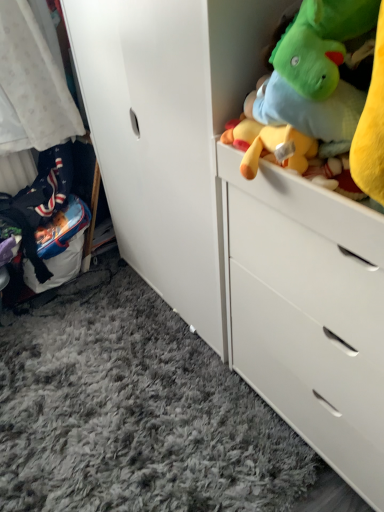
Question: From the image's perspective, relative to soft plush toys at upper right, is white matte chest of drawers at upper right above or below?

Choices:
 (A) above
 (B) below

Answer: (B)

Question: From a real-world perspective, is white matte chest of drawers at upper right positioned above or below soft plush toys at upper right?

Choices:
 (A) above
 (B) below

Answer: (B)

Question: Considering the real-world distances, which object is closest to the white soft fabric at left?

Choices:
 (A) soft plush toys at upper right
 (B) white matte chest of drawers at upper right

Answer: (B)

Question: Which object is positioned closest to the white soft fabric at left?

Choices:
 (A) soft plush toys at upper right
 (B) white matte chest of drawers at upper right

Answer: (B)